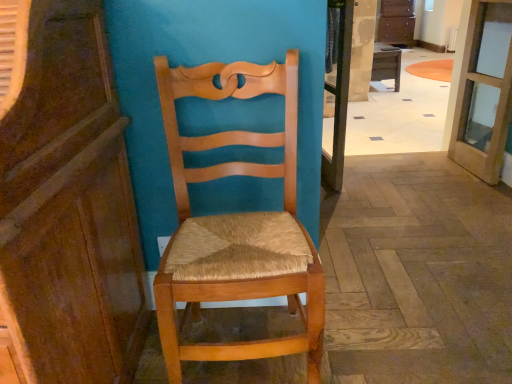
Question: Should I look upward or downward to see wooden woven seat chair at center?

Choices:
 (A) down
 (B) up

Answer: (A)

Question: Can you confirm if clear glass door at upper right is taller than clear glass screen door at center?

Choices:
 (A) no
 (B) yes

Answer: (A)

Question: Is clear glass door at upper right bigger than clear glass screen door at center?

Choices:
 (A) yes
 (B) no

Answer: (A)

Question: Does clear glass door at upper right have a lesser width compared to clear glass screen door at center?

Choices:
 (A) no
 (B) yes

Answer: (A)

Question: Is clear glass door at upper right next to clear glass screen door at center?

Choices:
 (A) no
 (B) yes

Answer: (A)

Question: From the image's perspective, is clear glass door at upper right located beneath clear glass screen door at center?

Choices:
 (A) no
 (B) yes

Answer: (A)

Question: Considering the relative positions of clear glass door at upper right and clear glass screen door at center in the image provided, is clear glass door at upper right to the right of clear glass screen door at center from the viewer's perspective?

Choices:
 (A) no
 (B) yes

Answer: (B)

Question: Is clear glass screen door at center not within wooden cabinet at left?

Choices:
 (A) no
 (B) yes

Answer: (B)

Question: Is wooden cabinet at left at the back of clear glass screen door at center?

Choices:
 (A) no
 (B) yes

Answer: (A)

Question: Considering the relative sizes of clear glass screen door at center and wooden cabinet at left in the image provided, is clear glass screen door at center shorter than wooden cabinet at left?

Choices:
 (A) yes
 (B) no

Answer: (B)

Question: Can you confirm if clear glass screen door at center is wider than wooden cabinet at left?

Choices:
 (A) yes
 (B) no

Answer: (B)

Question: Can you confirm if clear glass screen door at center is taller than wooden cabinet at left?

Choices:
 (A) yes
 (B) no

Answer: (A)

Question: From a real-world perspective, is clear glass screen door at center over wooden cabinet at left?

Choices:
 (A) yes
 (B) no

Answer: (B)

Question: Does polished wood floor at center have a lesser height compared to wooden desk at center?

Choices:
 (A) no
 (B) yes

Answer: (A)